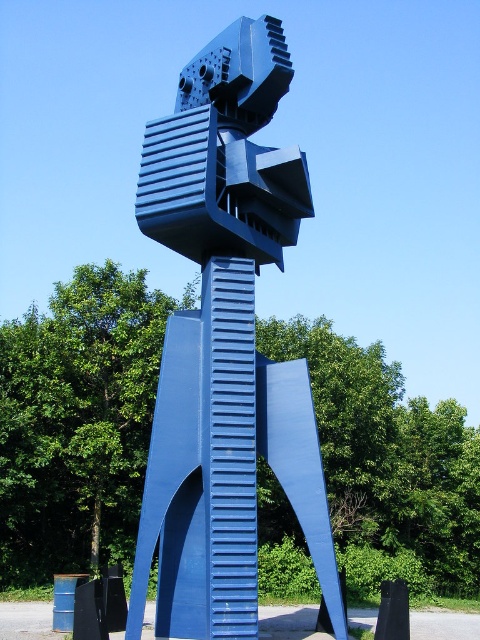
Who is more distant from viewer, [357,381] or [282,465]?

The point [357,381] is more distant.

Describe the element at coordinates (78, 420) in the screenshot. I see `blue metallic sculpture at center` at that location.

Which is behind, point (99, 428) or point (300, 164)?

The point (99, 428) is more distant.

The width and height of the screenshot is (480, 640). Identify the location of blue metallic sculpture at center. (78, 420).